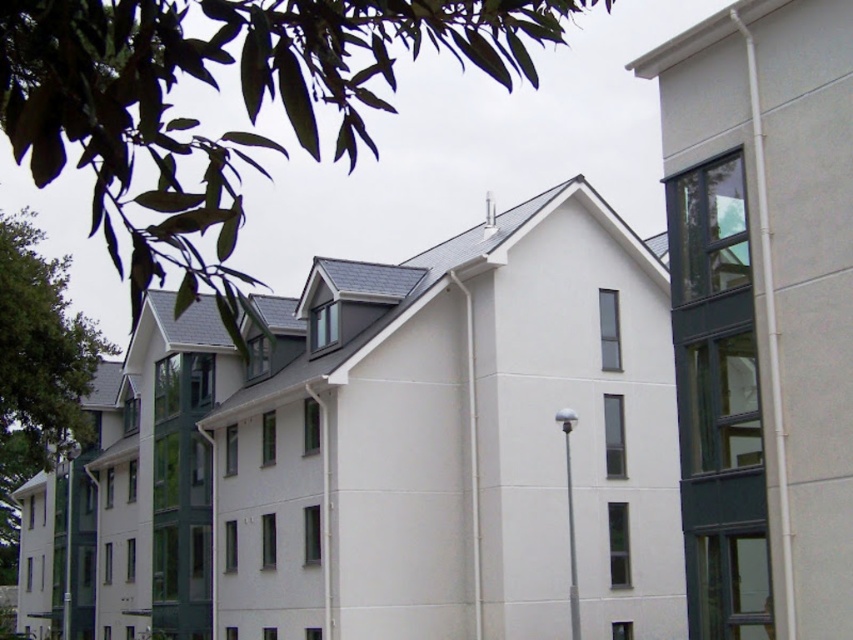
Question: Is green leafy tree at upper left smaller than green leafy tree at left?

Choices:
 (A) no
 (B) yes

Answer: (A)

Question: Does green leafy tree at upper left appear under green leafy tree at left?

Choices:
 (A) yes
 (B) no

Answer: (B)

Question: Is green leafy tree at upper left wider than green leafy tree at left?

Choices:
 (A) no
 (B) yes

Answer: (B)

Question: Which of the following is the closest to the observer?

Choices:
 (A) green leafy tree at upper left
 (B) green leafy tree at left

Answer: (A)

Question: Which object appears farthest from the camera in this image?

Choices:
 (A) green leafy tree at left
 (B) green leafy tree at upper left

Answer: (A)